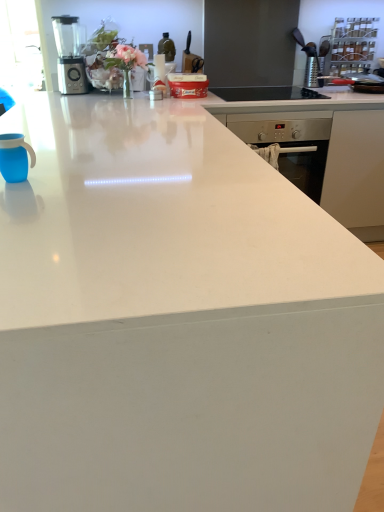
Question: Does black glass gas stove at upper center contain blue matte mug at left?

Choices:
 (A) yes
 (B) no

Answer: (B)

Question: From the image's perspective, is black glass gas stove at upper center below blue matte mug at left?

Choices:
 (A) yes
 (B) no

Answer: (B)

Question: Is black glass gas stove at upper center smaller than blue matte mug at left?

Choices:
 (A) yes
 (B) no

Answer: (B)

Question: From a real-world perspective, is black glass gas stove at upper center located higher than blue matte mug at left?

Choices:
 (A) no
 (B) yes

Answer: (A)

Question: Is black glass gas stove at upper center turned away from blue matte mug at left?

Choices:
 (A) no
 (B) yes

Answer: (A)

Question: Is black glass gas stove at upper center bigger than blue matte mug at left?

Choices:
 (A) yes
 (B) no

Answer: (A)

Question: Does blue matte mug at left have a greater height compared to black glass gas stove at upper center?

Choices:
 (A) no
 (B) yes

Answer: (B)

Question: Does blue matte mug at left appear on the left side of black glass gas stove at upper center?

Choices:
 (A) no
 (B) yes

Answer: (B)

Question: Is blue matte mug at left further to the viewer compared to black glass gas stove at upper center?

Choices:
 (A) yes
 (B) no

Answer: (B)

Question: Considering the relative positions of blue matte mug at left and black glass gas stove at upper center in the image provided, is blue matte mug at left in front of black glass gas stove at upper center?

Choices:
 (A) yes
 (B) no

Answer: (A)

Question: From a real-world perspective, is blue matte mug at left located higher than black glass gas stove at upper center?

Choices:
 (A) yes
 (B) no

Answer: (A)

Question: Does blue matte mug at left have a greater width compared to black glass gas stove at upper center?

Choices:
 (A) yes
 (B) no

Answer: (B)

Question: Is blue matte mug at left taller than metallic silver blender at upper left?

Choices:
 (A) no
 (B) yes

Answer: (A)